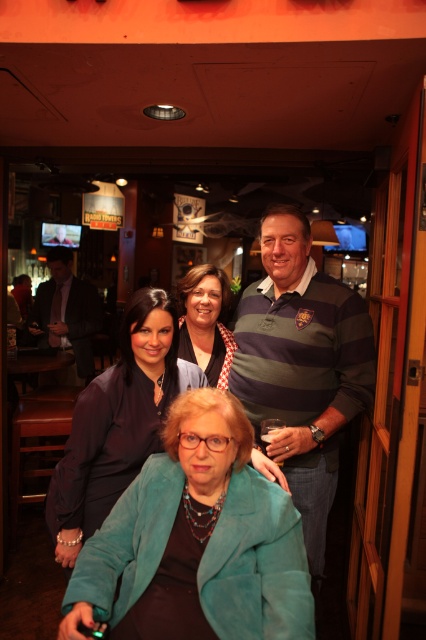
You are a fashion designer observing the scene. You need to decide which garment to recommend for a client who prefers compact, space saving options. Which one between the teal fabric jacket at lower center and the dark gray suit at left would you suggest?

The teal fabric jacket at lower center is smaller than the dark gray suit at left, so the teal fabric jacket at lower center would be the better recommendation for compact storage needs.

You are a photographer setting up for a group photo in the bar. You need to ensure that the teal fabric jacket at lower center and the matte black shirt at center are both visible in the frame. Based on their positions, which one is closer to the camera?

The teal fabric jacket at lower center is positioned under the matte black shirt at center, so the teal fabric jacket at lower center is closer to the camera.

You are a fashion designer observing the scene. You notice the teal fabric jacket at lower center and the matte black shirt at center. Which clothing item would require more fabric to produce a similar design?

The teal fabric jacket at lower center would require more fabric to produce a similar design since it is larger in size than the matte black shirt at center.